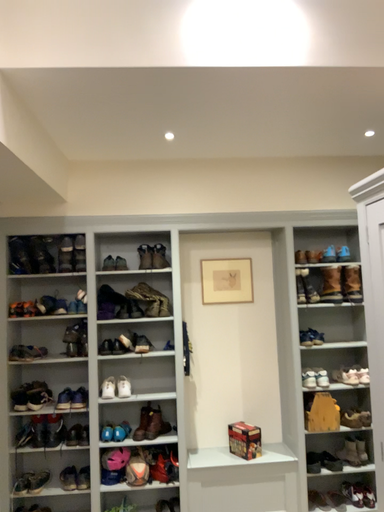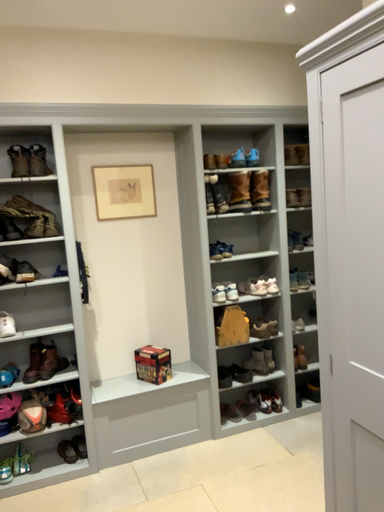
Question: Which way did the camera rotate in the video?

Choices:
 (A) rotated downward
 (B) rotated upward

Answer: (A)